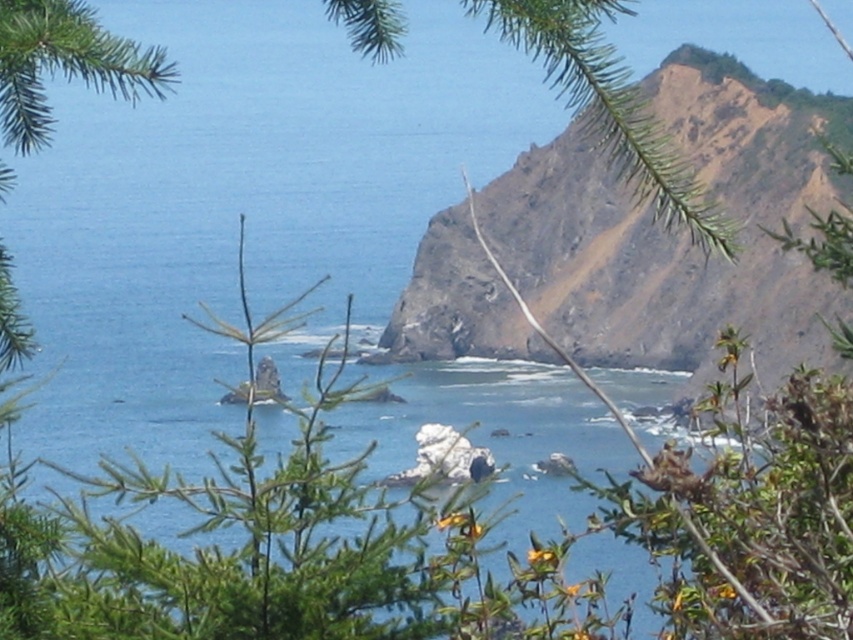
You are standing on the beach and see the green leafy tree at center and the white rock at center. Which object is closer to your left side?

The green leafy tree at center is positioned on the left side of white rock at center, so it is closer to your left side.

In the scene shown: You are a hiker standing at the base of the rusty rock cliff at upper right and want to reach the white rock at center. Which direction should you move to get there?

The white rock at center is behind the rusty rock cliff at upper right, so you should move backward away from the cliff to reach it.

You are a geologist examining the coastal landscape. You need to locate the rusty rock cliff at upper right. According to the coordinates provided, where exactly is it positioned in the image?

The rusty rock cliff at upper right is located at point (676, 232), which means it is positioned in the upper right area of the image based on the coordinate system provided.